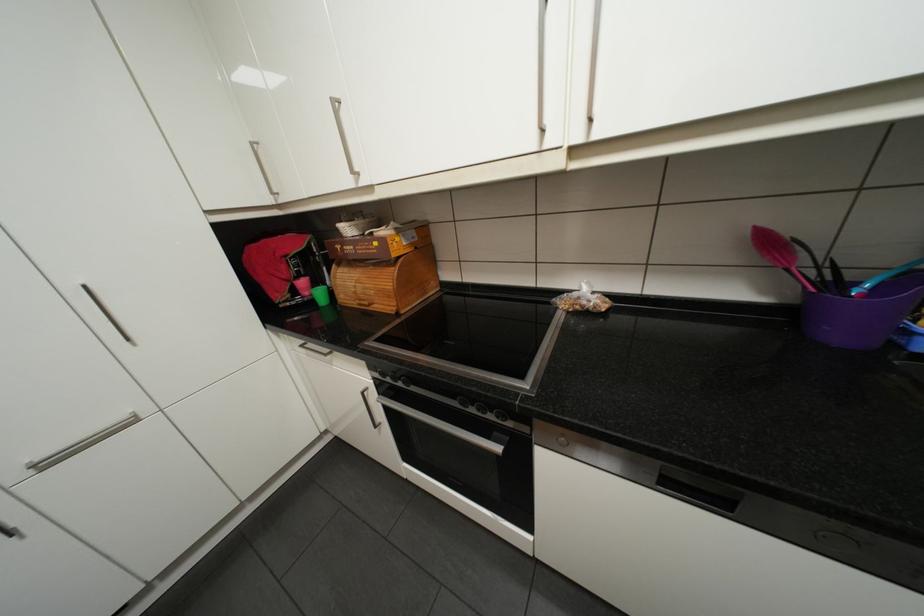
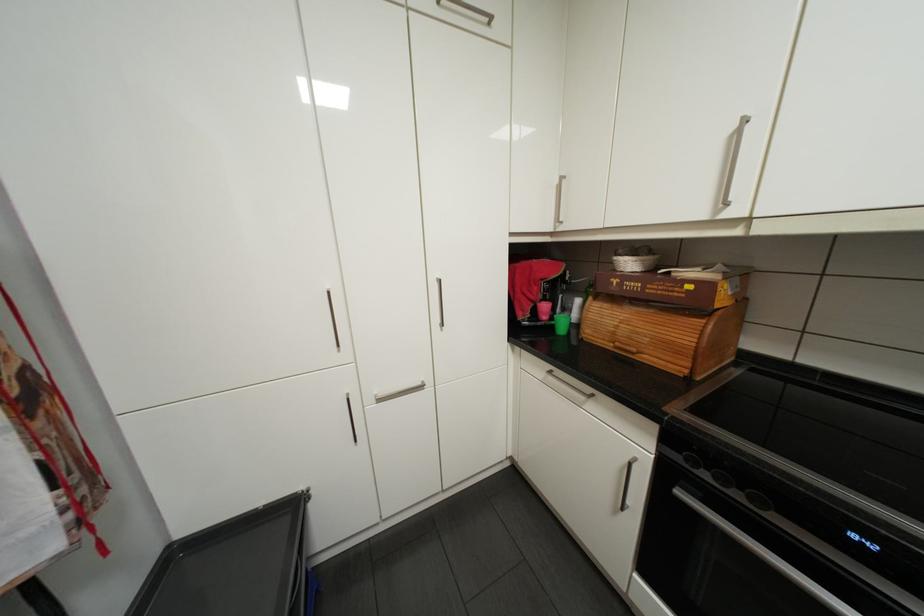
The point at (325, 281) is marked in the first image. Where is the corresponding point in the second image?

(562, 307)